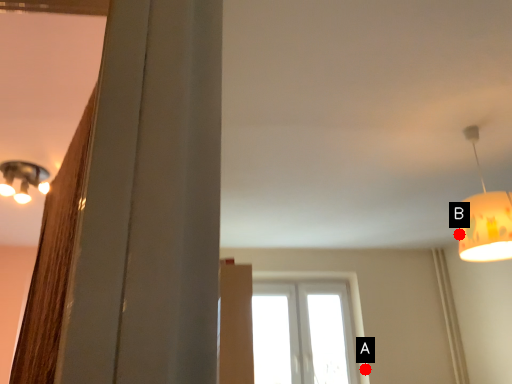
Question: Two points are circled on the image, labeled by A and B beside each circle. Which point is farther to the camera?

Choices:
 (A) A is further
 (B) B is further

Answer: (A)